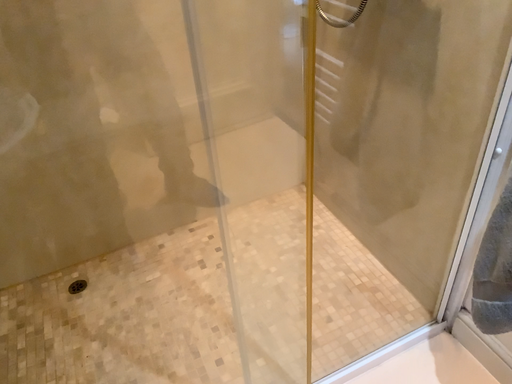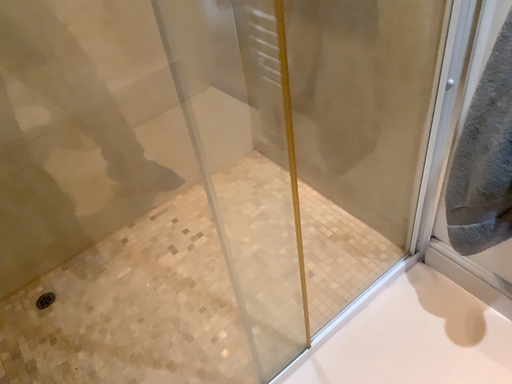
Question: Which way did the camera rotate in the video?

Choices:
 (A) rotated right
 (B) rotated left

Answer: (A)